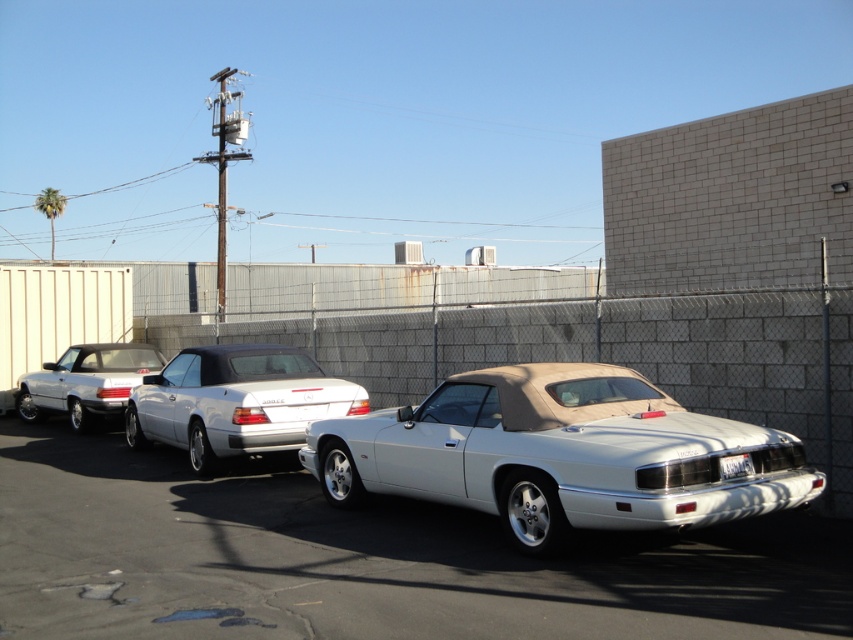
Question: Which point appears closest to the camera in this image?

Choices:
 (A) (744, 458)
 (B) (444, 392)

Answer: (A)

Question: Can you confirm if white matte convertible at center is positioned above metallic chain-link fence at center?

Choices:
 (A) yes
 (B) no

Answer: (B)

Question: Can you confirm if white glossy sedan at center is smaller than white plastic license plate at rear?

Choices:
 (A) yes
 (B) no

Answer: (B)

Question: Which object appears farthest from the camera in this image?

Choices:
 (A) metallic chain-link fence at center
 (B) white glossy sedan at center
 (C) white plastic license plate at rear

Answer: (B)

Question: Can you confirm if white metallic car at center is smaller than white glossy sedan at center?

Choices:
 (A) no
 (B) yes

Answer: (A)

Question: Among these points, which one is nearest to the camera?

Choices:
 (A) (39, 589)
 (B) (764, 493)
 (C) (720, 477)
 (D) (51, 368)

Answer: (C)